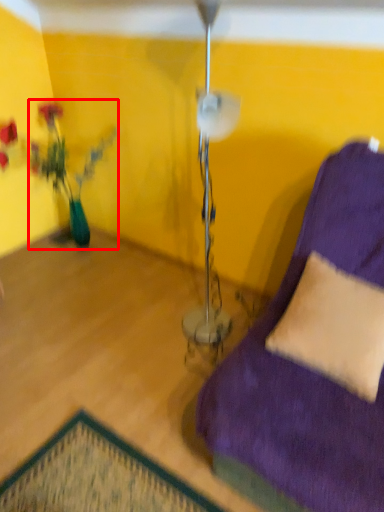
Question: From the image's perspective, what is the correct spatial positioning of houseplant (annotated by the red box) in reference to pillow?

Choices:
 (A) above
 (B) below

Answer: (A)